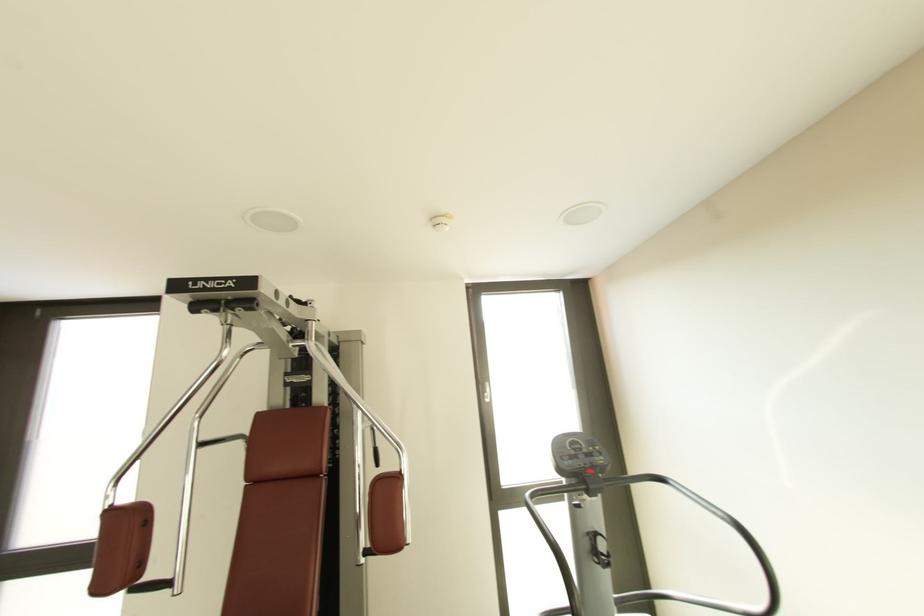
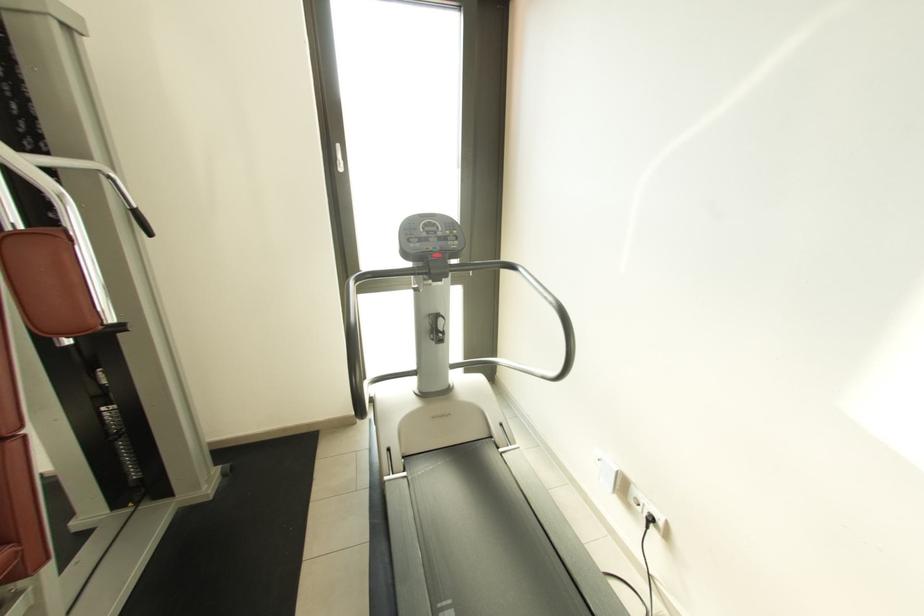
Find the pixel in the second image that matches point (584, 447) in the first image.

(439, 230)